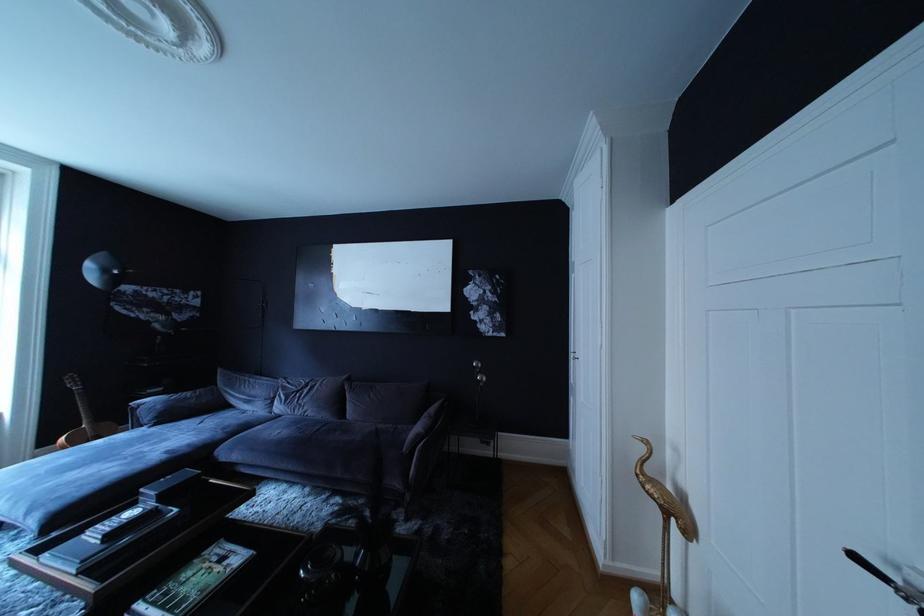
Find where to lift the acoustic guitar. Please return your answer as a coordinate pair (x, y).

(82, 419)